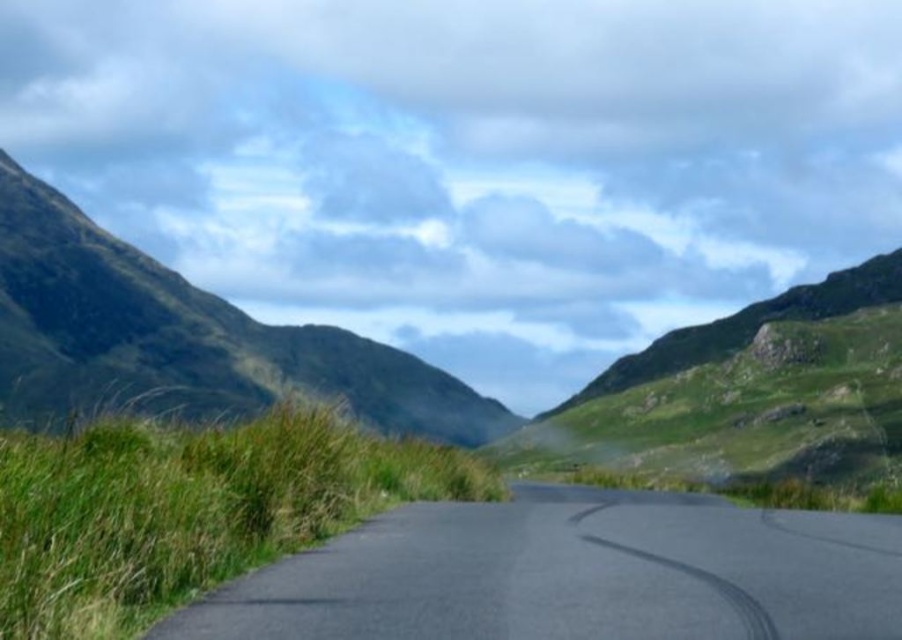
You are a hiker planning to cross the black asphalt road at center and climb the green grassy hillside at left. Which path would be higher in elevation when you reach the top?

The green grassy hillside at left is taller than the black asphalt road at center, so the hillside would be higher in elevation when you reach the top.

You are a hiker planning to cross the black asphalt road at center and the green grassy hillside at left. Which path would you choose if you want to take the narrower route?

The black asphalt road at center is thinner than the green grassy hillside at left, so you should choose the black asphalt road at center for the narrower route.